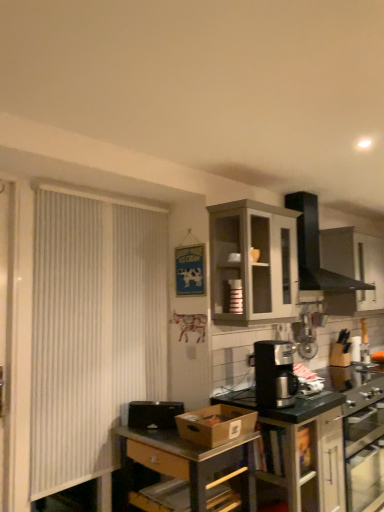
Question: Is matte black coffee maker at center, positioned as the first cabinetry in bottom-to-top order, to the left or to the right of metallic gray table at center in the image?

Choices:
 (A) right
 (B) left

Answer: (A)

Question: Is point (309, 418) closer or farther from the camera than point (135, 433)?

Choices:
 (A) farther
 (B) closer

Answer: (B)

Question: Estimate the real-world distances between objects in this image. Which object is farther from the black matte vent at upper center?

Choices:
 (A) black plastic coffee maker at lower right
 (B) metallic gray table at center
 (C) white fabric curtain at left
 (D) black plastic coffee maker at center
 (E) matte black coffee maker at center, positioned as the first cabinetry in bottom-to-top order

Answer: (C)

Question: Which object is positioned closest to the black plastic coffee maker at center?

Choices:
 (A) white fabric curtain at left
 (B) matte gray cabinet at upper center, the 1th cabinetry in the top-to-bottom sequence
 (C) black matte vent at upper center
 (D) matte black coffee maker at center, which is the second cabinetry in top-to-bottom order
 (E) metallic gray table at center

Answer: (D)